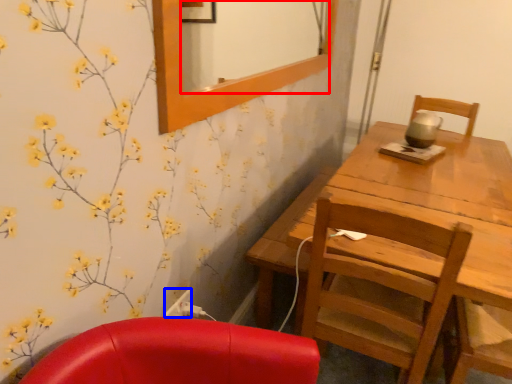
Question: Which object is further to the camera taking this photo, mirror (highlighted by a red box) or power outlet (highlighted by a blue box)?

Choices:
 (A) mirror
 (B) power outlet

Answer: (B)